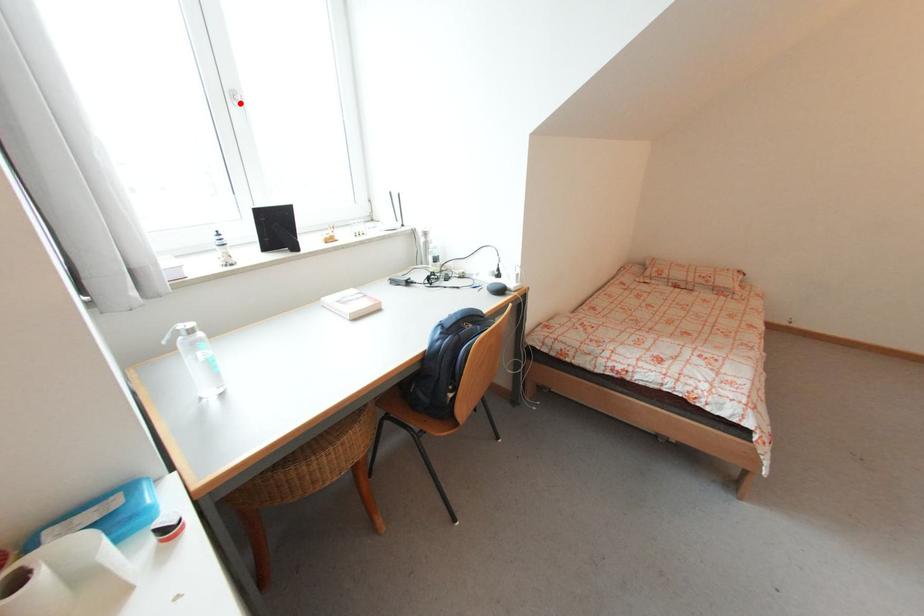
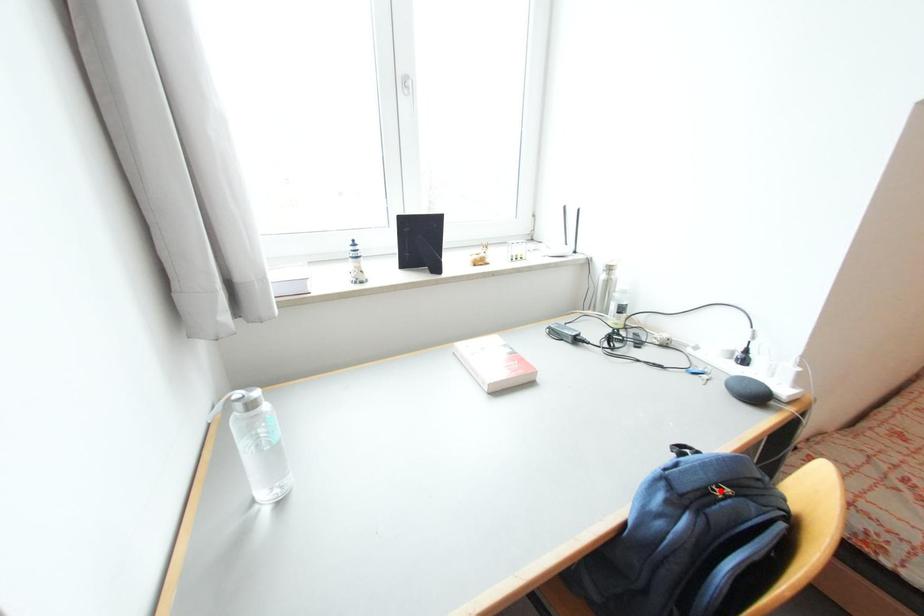
I am providing you with two images of the same scene from different viewpoints. A red point is marked on the first image and another point is marked on the second image. Do the highlighted points in image1 and image2 indicate the same real-world spot?

No